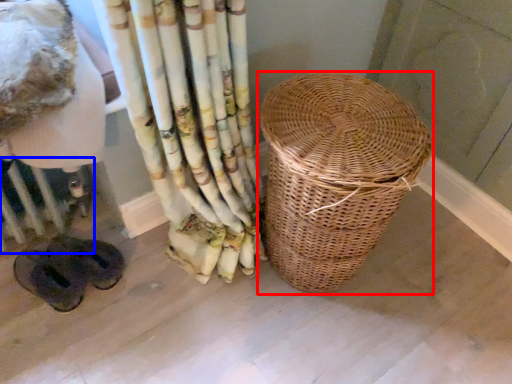
Question: Which of the following is the closest to the observer, picnic basket (highlighted by a red box) or radiator (highlighted by a blue box)?

Choices:
 (A) picnic basket
 (B) radiator

Answer: (A)